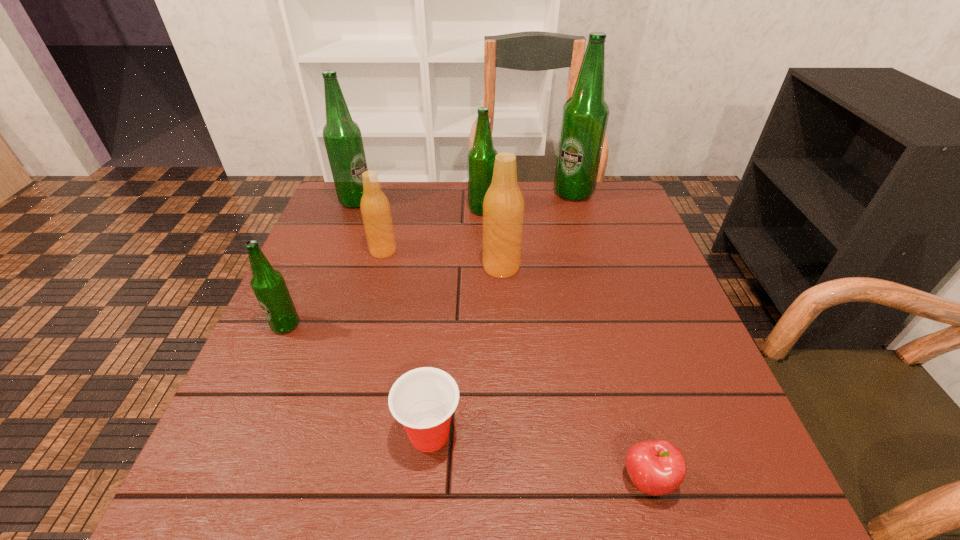
Where is `cup`? The image size is (960, 540). cup is located at coordinates (423, 400).

You are a GUI agent. You are given a task and a screenshot of the screen. Output one action in this format:
    pyautogui.click(x=<x>, y=<y>)
    Task: Click on the seventh tallest object
    
    Given the screenshot: What is the action you would take?
    pyautogui.click(x=423, y=400)

I want to click on apple, so click(657, 467).

Where is `the shortest object`? The image size is (960, 540). the shortest object is located at coordinates (657, 467).

The height and width of the screenshot is (540, 960). I want to click on free spot located on the label of the tallest object, so click(x=602, y=292).

The image size is (960, 540). What are the coordinates of `free point located 0.280m on the label of the second tallest beer bottle` in the screenshot? It's located at (466, 201).

Image resolution: width=960 pixels, height=540 pixels. Identify the location of free region located 0.280m on the label of the second green beer bottle from right to left. (373, 210).

The image size is (960, 540). In order to click on vacant space situated 0.120m on the label of the second green beer bottle from right to left in this screenshot , I will do `click(428, 210)`.

Identify the location of blank area located 0.120m on the label of the second green beer bottle from right to left. (428, 210).

You are a GUI agent. You are given a task and a screenshot of the screen. Output one action in this format:
    pyautogui.click(x=<x>, y=<y>)
    Task: Click on the vacant region located on the left of the right tan beer bottle
    The image size is (960, 540).
    Given the screenshot: What is the action you would take?
    pyautogui.click(x=450, y=267)